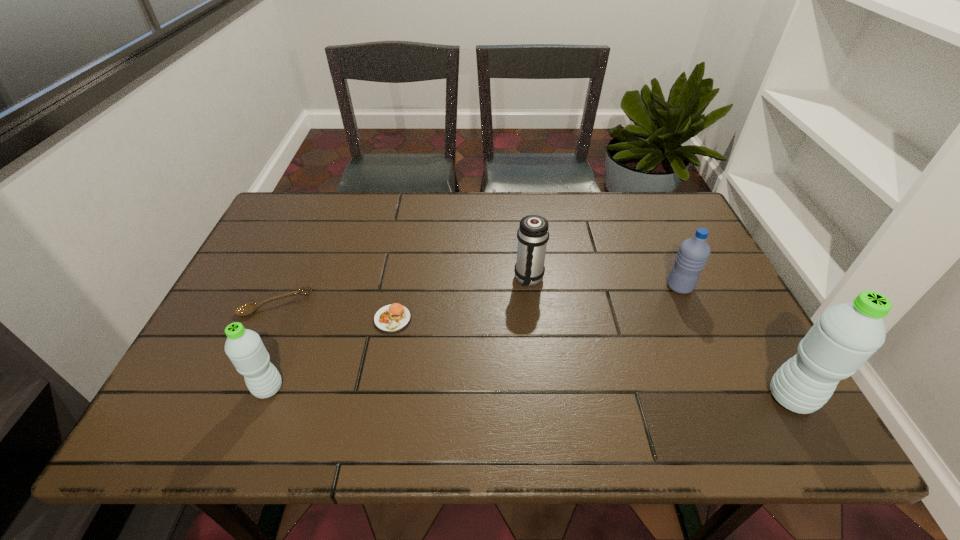
You are a GUI agent. You are given a task and a screenshot of the screen. Output one action in this format:
    pyautogui.click(x=<x>, y=<y>)
    Task: Click on the leftmost water bottle
    This screenshot has height=540, width=960.
    Given the screenshot: What is the action you would take?
    pyautogui.click(x=244, y=347)

I want to click on the tallest object, so click(x=845, y=336).

Locate an element on the screen. the rightmost water bottle is located at coordinates (845, 336).

This screenshot has width=960, height=540. Identify the location of thermos bottle. (533, 234).

The image size is (960, 540). Identify the location of the fourth object from right to left. (391, 318).

Identify the location of the second shortest object. (391, 318).

Find the location of `the farthest water bottle`. the farthest water bottle is located at coordinates (693, 253).

You are a GUI agent. You are given a task and a screenshot of the screen. Output one action in this format:
    pyautogui.click(x=<x>, y=<y>)
    Task: Click on the fifth object from left to right
    The width and height of the screenshot is (960, 540).
    Given the screenshot: What is the action you would take?
    pyautogui.click(x=693, y=253)

Find the location of a particular element. The image size is (960, 540). the shortest object is located at coordinates (246, 309).

Identify the location of vacant space situated 0.330m on the back of the leftmost water bottle. (314, 272).